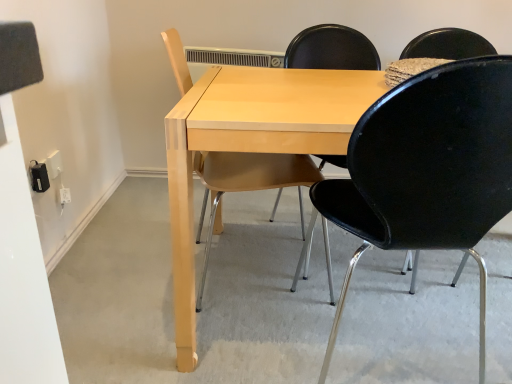
Question: Is black plastic chair at center, which is counted as the first chair, starting from the right, bigger than light wood chair at center, which appears as the 1th chair when viewed from the left?

Choices:
 (A) no
 (B) yes

Answer: (B)

Question: Is black plastic chair at center, positioned as the 2th chair in left-to-right order, wider than light wood chair at center, which appears as the 1th chair when viewed from the left?

Choices:
 (A) yes
 (B) no

Answer: (A)

Question: Does black plastic chair at center, which is counted as the first chair, starting from the right, have a lesser height compared to light wood chair at center, the 2th chair positioned from the right?

Choices:
 (A) no
 (B) yes

Answer: (B)

Question: Is black plastic chair at center, which is counted as the first chair, starting from the right, behind light wood chair at center, which appears as the 1th chair when viewed from the left?

Choices:
 (A) no
 (B) yes

Answer: (A)

Question: Is black plastic chair at center, which is counted as the first chair, starting from the right, at the right side of light wood chair at center, the 2th chair positioned from the right?

Choices:
 (A) yes
 (B) no

Answer: (A)

Question: Considering the positions of light wood chair at center, which appears as the 1th chair when viewed from the left, and light wood table at center in the image, is light wood chair at center, which appears as the 1th chair when viewed from the left, bigger or smaller than light wood table at center?

Choices:
 (A) big
 (B) small

Answer: (B)

Question: Would you say light wood chair at center, the 2th chair positioned from the right, is to the left or to the right of light wood table at center in the picture?

Choices:
 (A) left
 (B) right

Answer: (A)

Question: From a real-world perspective, is light wood chair at center, the 2th chair positioned from the right, positioned above or below light wood table at center?

Choices:
 (A) above
 (B) below

Answer: (A)

Question: Which is correct: light wood chair at center, the 2th chair positioned from the right, is inside light wood table at center, or outside of it?

Choices:
 (A) inside
 (B) outside

Answer: (A)

Question: In terms of size, does light wood chair at center, the 2th chair positioned from the right, appear bigger or smaller than black plastic chair at center, positioned as the 2th chair in left-to-right order?

Choices:
 (A) big
 (B) small

Answer: (B)

Question: Would you say light wood chair at center, the 2th chair positioned from the right, is inside or outside black plastic chair at center, which is counted as the first chair, starting from the right?

Choices:
 (A) inside
 (B) outside

Answer: (B)

Question: From a real-world perspective, relative to black plastic chair at center, positioned as the 2th chair in left-to-right order, is light wood chair at center, the 2th chair positioned from the right, vertically above or below?

Choices:
 (A) below
 (B) above

Answer: (A)

Question: Based on their positions, is light wood chair at center, the 2th chair positioned from the right, located to the left or right of black plastic chair at center, positioned as the 2th chair in left-to-right order?

Choices:
 (A) left
 (B) right

Answer: (A)

Question: Considering the positions of point (400, 110) and point (336, 110), is point (400, 110) closer or farther from the camera than point (336, 110)?

Choices:
 (A) farther
 (B) closer

Answer: (B)

Question: Relative to light wood table at center, is black plastic chair at center, which is counted as the first chair, starting from the right, in front or behind?

Choices:
 (A) behind
 (B) front

Answer: (B)